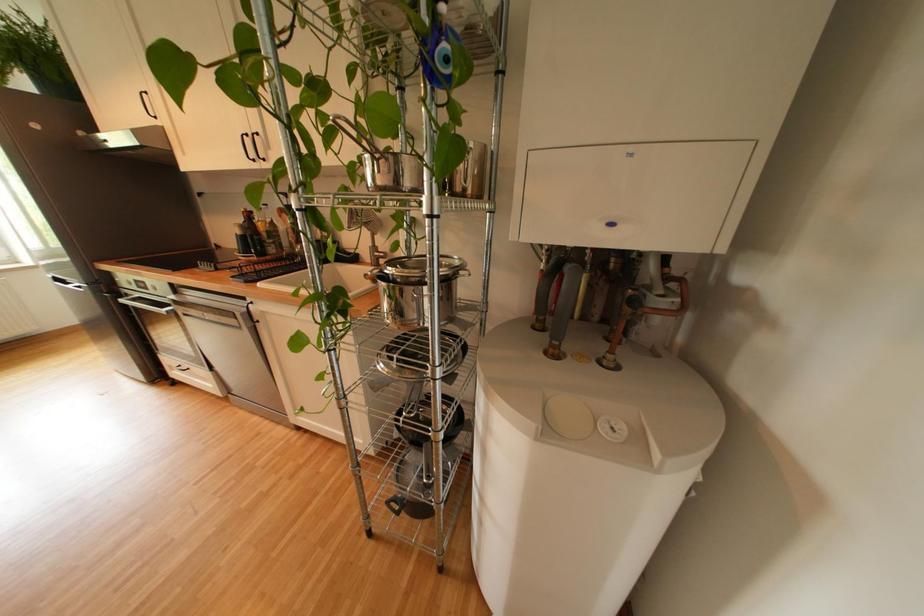
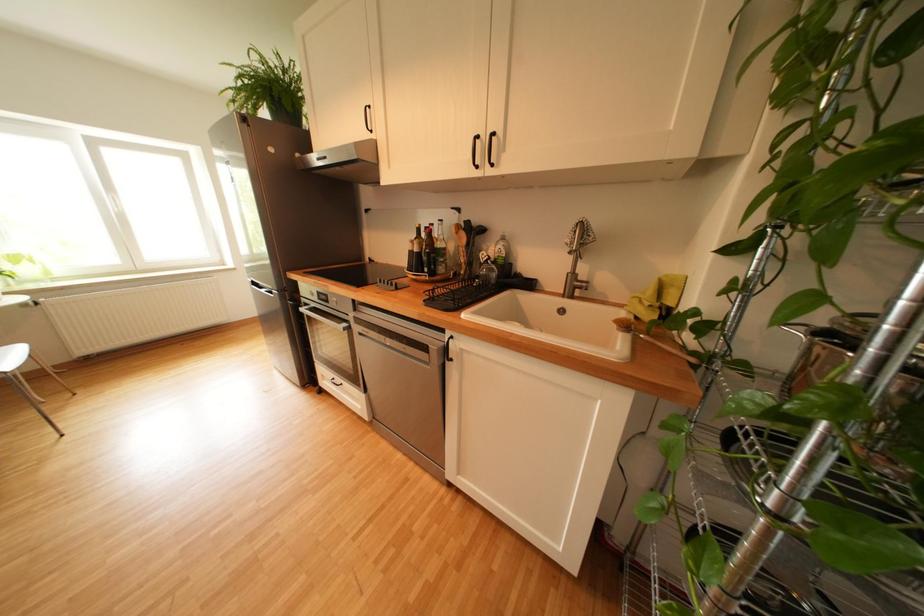
Question: The camera is either moving clockwise (left) or counter-clockwise (right) around the object. The first image is from the beginning of the video and the second image is from the end. Is the camera moving left or right when shooting the video?

Choices:
 (A) Left
 (B) Right

Answer: (B)